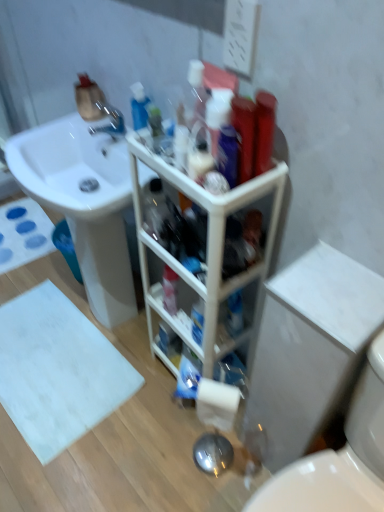
Locate an element on the screen. free spot above white matte bath mat at lower left, the second bath mat from the back (from a real-world perspective) is located at coordinates (50, 373).